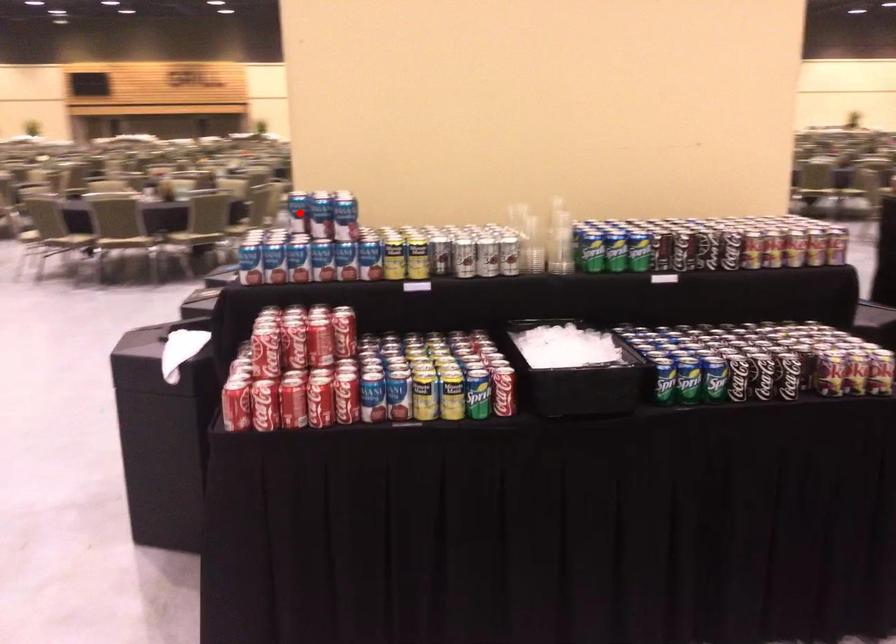
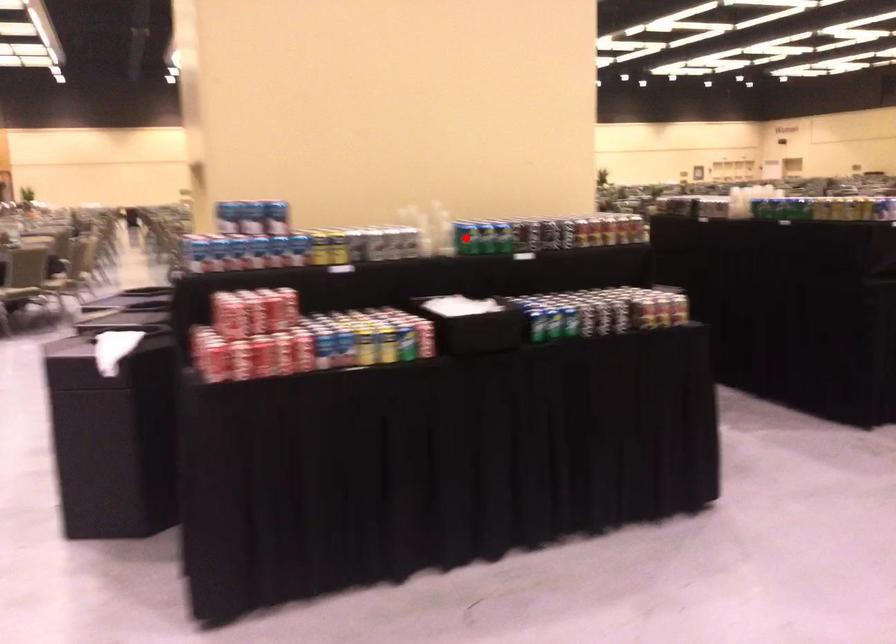
I am providing you with two images of the same scene from different viewpoints. A red point is marked on the first image and another point is marked on the second image. Is the marked point in image1 the same physical position as the marked point in image2?

No